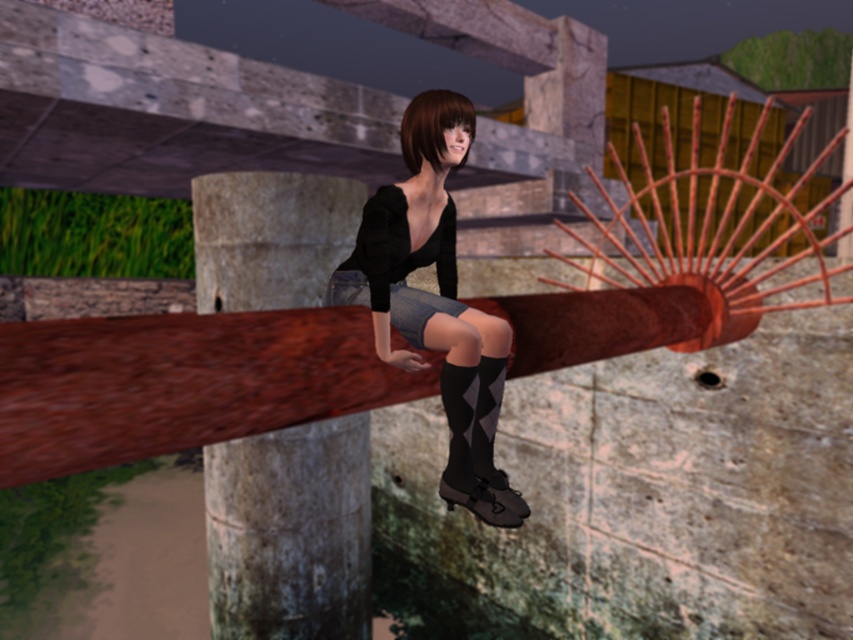
You are a fashion designer analyzing the outfit of the character in the image. The character is wearing a black matte dress at center and black textured sock at lower center. How far apart are these two items on the character?

The black matte dress at center and black textured sock at lower center are 49.35 centimeters apart from each other.

You are a game character trying to jump from the black matte dress at center to the black textured sock at lower center. Can you reach the sock without falling?

The black matte dress at center is taller than the black textured sock at lower center, so you can jump down to the sock safely.